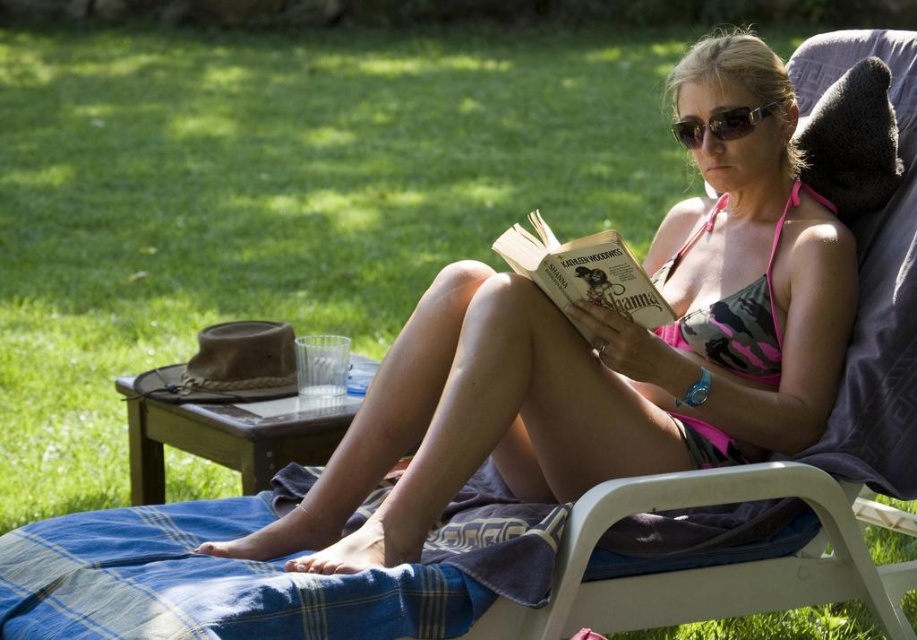
Who is more forward, (330, 592) or (601, 304)?

Positioned in front is point (330, 592).

Can you confirm if blue plaid blanket at lower center is positioned to the left of hardcover book at center?

Indeed, blue plaid blanket at lower center is positioned on the left side of hardcover book at center.

The image size is (917, 640). I want to click on blue plaid blanket at lower center, so click(264, 572).

Which is below, pink camouflage bikini at center or blue plaid blanket at lower center?

blue plaid blanket at lower center

Does point (667, 232) lie in front of point (120, 522)?

No, it is not.

I want to click on pink camouflage bikini at center, so click(605, 352).

Is point (791, 365) positioned after point (599, 294)?

Yes, it is.

Can you confirm if pink camouflage bikini at center is shorter than hardcover book at center?

Incorrect, pink camouflage bikini at center's height does not fall short of hardcover book at center's.

What do you see at coordinates (605, 352) in the screenshot? I see `pink camouflage bikini at center` at bounding box center [605, 352].

You are a GUI agent. You are given a task and a screenshot of the screen. Output one action in this format:
    pyautogui.click(x=<x>, y=<y>)
    Task: Click on the pink camouflage bikini at center
    This screenshot has width=917, height=640.
    Given the screenshot: What is the action you would take?
    [605, 352]